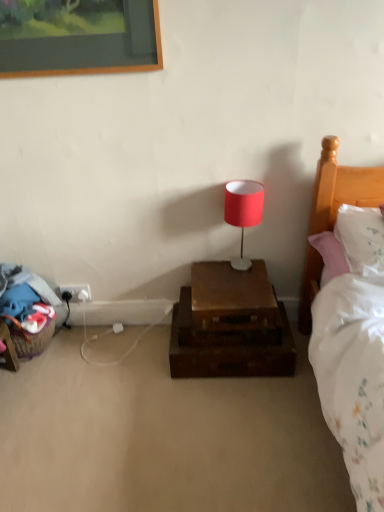
Question: From the image's perspective, is wooden suitcase at center on matte red lampshade at center?

Choices:
 (A) yes
 (B) no

Answer: (B)

Question: From a real-world perspective, is wooden suitcase at center positioned under matte red lampshade at center based on gravity?

Choices:
 (A) no
 (B) yes

Answer: (B)

Question: From the image's perspective, would you say wooden suitcase at center is shown under matte red lampshade at center?

Choices:
 (A) yes
 (B) no

Answer: (A)

Question: Could you tell me if wooden suitcase at center is facing matte red lampshade at center?

Choices:
 (A) no
 (B) yes

Answer: (A)

Question: Does wooden suitcase at center have a lesser width compared to matte red lampshade at center?

Choices:
 (A) no
 (B) yes

Answer: (A)

Question: Is white soft pillow at right wider or thinner than wooden suitcase at center?

Choices:
 (A) wide
 (B) thin

Answer: (A)

Question: From their relative heights in the image, would you say white soft pillow at right is taller or shorter than wooden suitcase at center?

Choices:
 (A) short
 (B) tall

Answer: (B)

Question: From the image's perspective, is white soft pillow at right above or below wooden suitcase at center?

Choices:
 (A) above
 (B) below

Answer: (A)

Question: From a real-world perspective, is white soft pillow at right positioned above or below wooden suitcase at center?

Choices:
 (A) below
 (B) above

Answer: (B)

Question: From their relative heights in the image, would you say white plastic electrical outlet at lower left is taller or shorter than wooden suitcase at center?

Choices:
 (A) short
 (B) tall

Answer: (A)

Question: In terms of size, does white plastic electrical outlet at lower left appear bigger or smaller than wooden suitcase at center?

Choices:
 (A) big
 (B) small

Answer: (B)

Question: In the image, is white plastic electrical outlet at lower left on the left side or the right side of wooden suitcase at center?

Choices:
 (A) right
 (B) left

Answer: (B)

Question: Is white plastic electrical outlet at lower left wider or thinner than wooden suitcase at center?

Choices:
 (A) wide
 (B) thin

Answer: (B)

Question: From a real-world perspective, relative to matte red lampshade at center, is white plastic electrical outlet at lower left vertically above or below?

Choices:
 (A) below
 (B) above

Answer: (A)

Question: Is white plastic electrical outlet at lower left situated inside matte red lampshade at center or outside?

Choices:
 (A) inside
 (B) outside

Answer: (B)